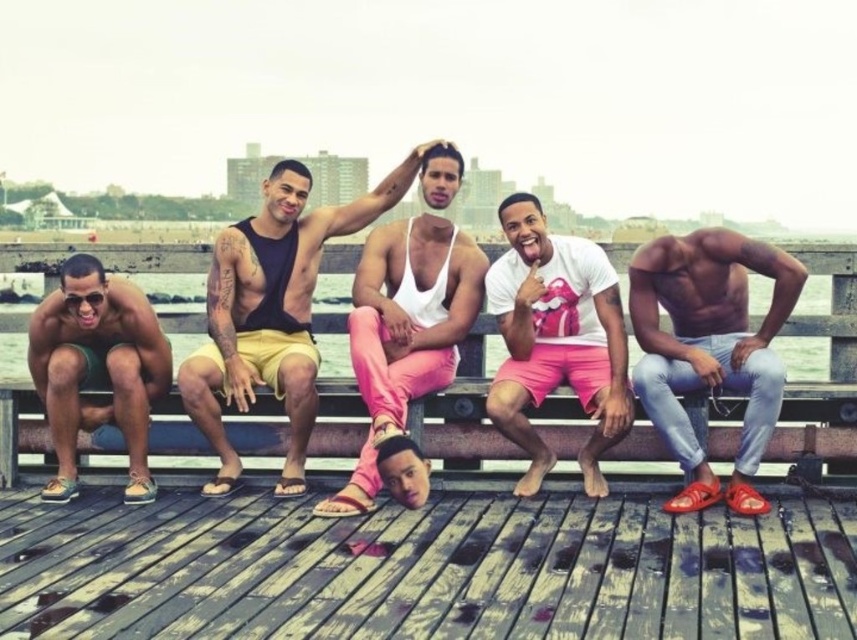
Question: Can you confirm if matte black tank top at center is positioned above white matte tank top at center?

Choices:
 (A) yes
 (B) no

Answer: (B)

Question: Which point appears closest to the camera in this image?

Choices:
 (A) (440, 360)
 (B) (28, 589)

Answer: (B)

Question: Based on their relative distances, which object is farther from the matte skin torso at center?

Choices:
 (A) white matte t-shirt at center
 (B) weathered wood dock at lower center

Answer: (B)

Question: Does matte skin torso at center appear over white matte tank top at center?

Choices:
 (A) no
 (B) yes

Answer: (A)

Question: Which point appears closest to the camera in this image?

Choices:
 (A) (573, 435)
 (B) (234, 522)

Answer: (B)

Question: In this image, where is weathered wood dock at lower center located relative to matte skin torso at center?

Choices:
 (A) above
 (B) below

Answer: (B)